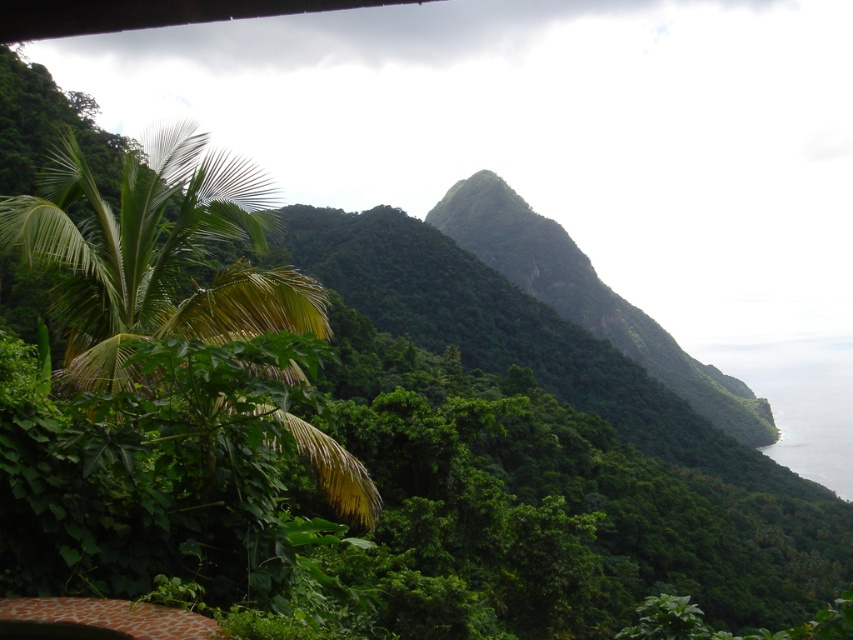
Is green leafy hill at center wider than clear water at lower right?

Indeed, green leafy hill at center has a greater width compared to clear water at lower right.

Which is behind, point (602, 296) or point (793, 380)?

Point (793, 380)

This screenshot has width=853, height=640. What are the coordinates of `green leafy hill at center` in the screenshot? It's located at (589, 298).